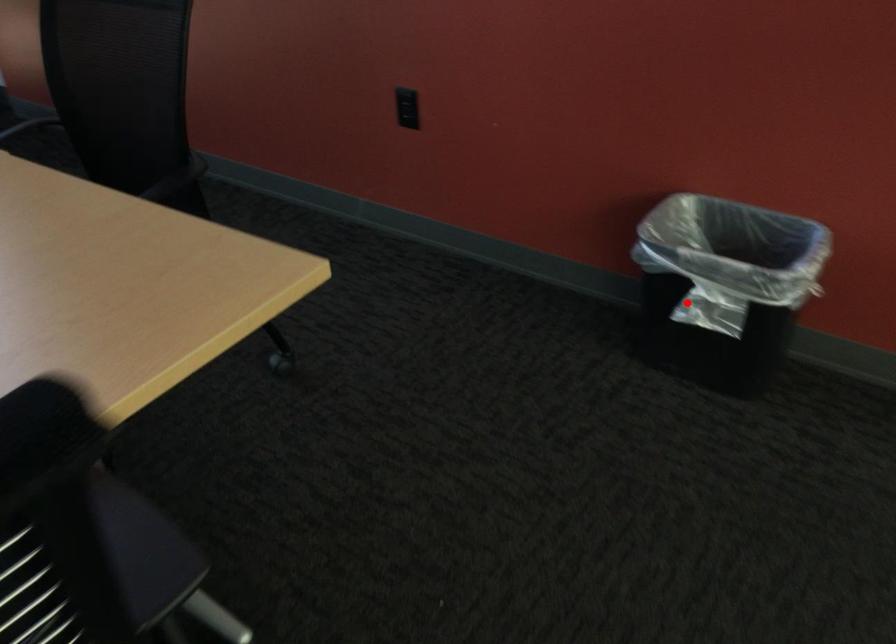
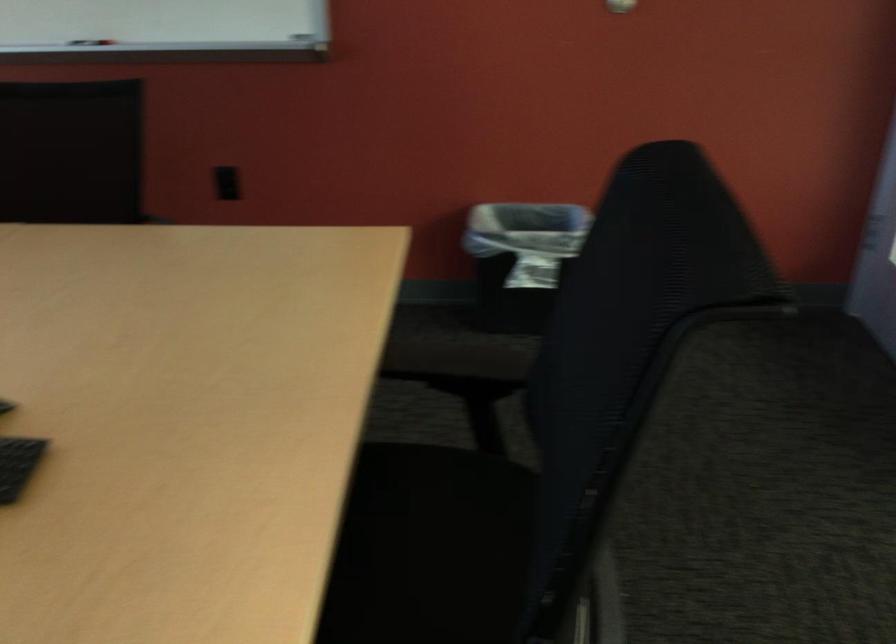
Find the pixel in the second image that matches the highlighted location in the first image.

(521, 260)